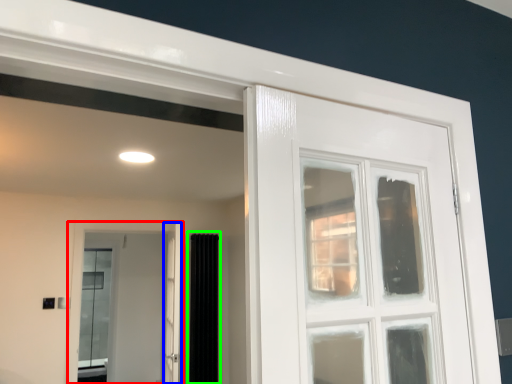
Question: Estimate the real-world distances between objects in this image. Which object is farther from door (highlighted by a red box), screen door (highlighted by a blue box) or curtain (highlighted by a green box)?

Choices:
 (A) screen door
 (B) curtain

Answer: (A)